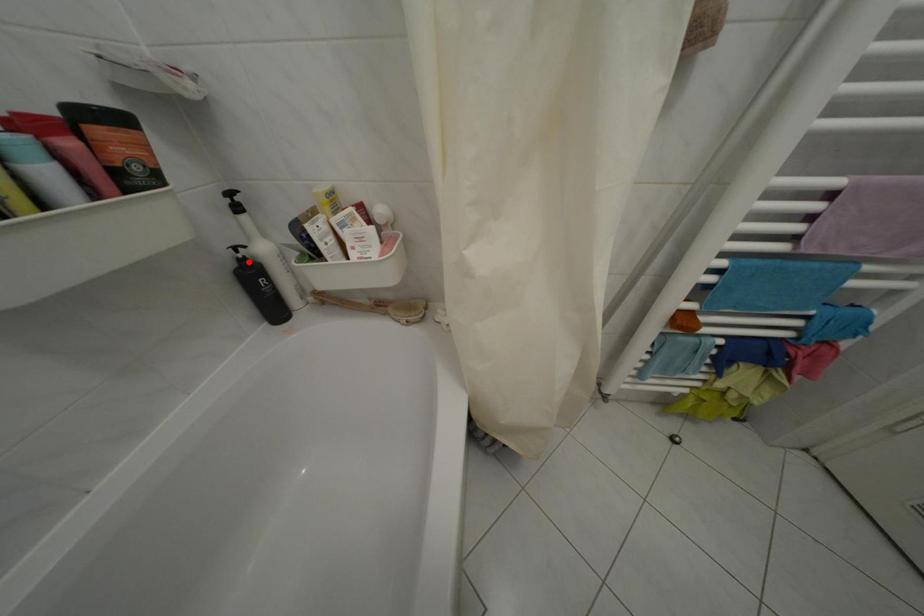
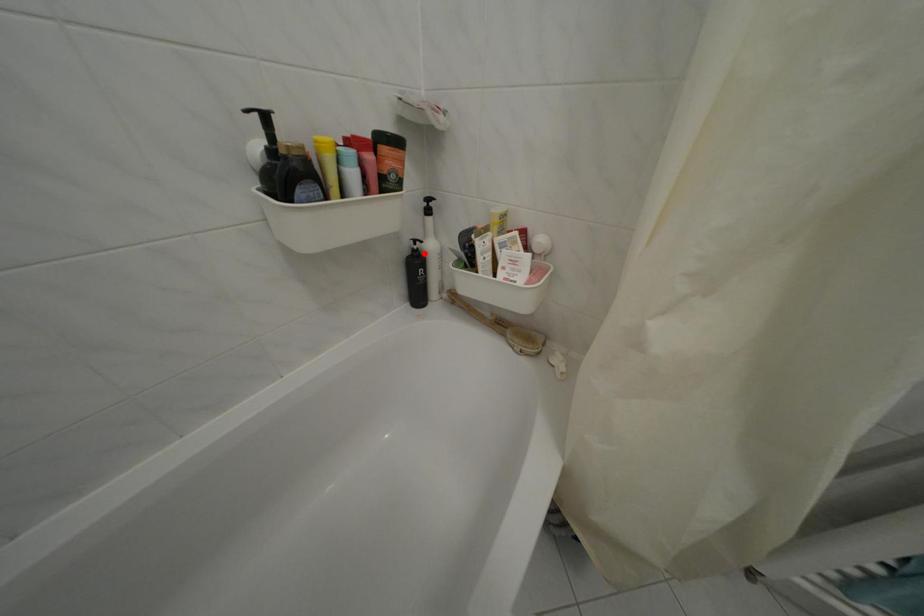
I am providing you with two images of the same scene from different viewpoints. A red point is marked on the first image and another point is marked on the second image. Are the points marked in image1 and image2 representing the same 3D position?

Yes